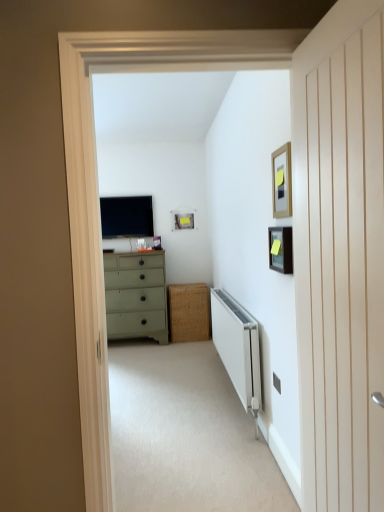
You are a GUI agent. You are given a task and a screenshot of the screen. Output one action in this format:
    pyautogui.click(x=<x>, y=<y>)
    Task: Click on the vacant space in front of light green painted wood chest of drawers at center
    The image size is (384, 512).
    Given the screenshot: What is the action you would take?
    pyautogui.click(x=148, y=359)